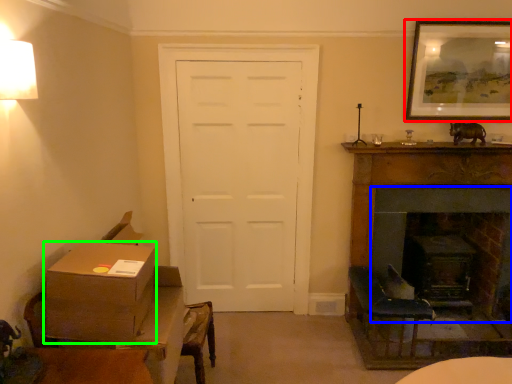
Question: Estimate the real-world distances between objects in this image. Which object is farther from picture frame (highlighted by a red box), fireplace (highlighted by a blue box) or box (highlighted by a green box)?

Choices:
 (A) fireplace
 (B) box

Answer: (B)